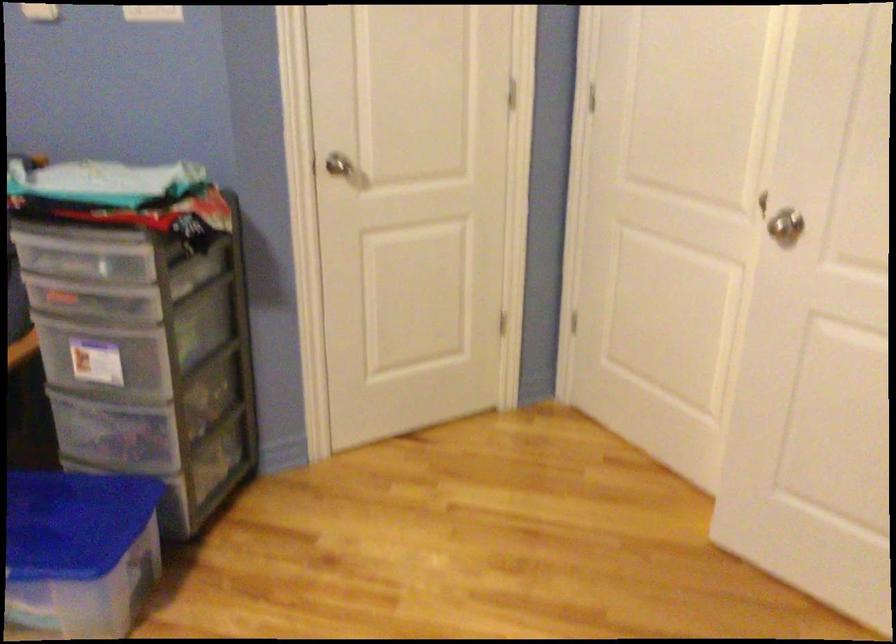
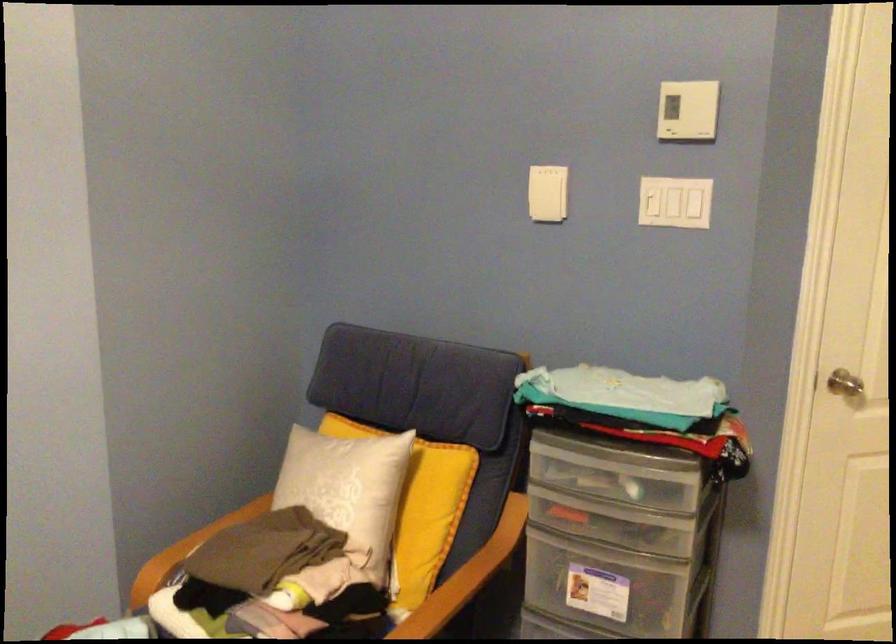
Where in the second image is the point corresponding to [331,172] from the first image?

(846, 384)